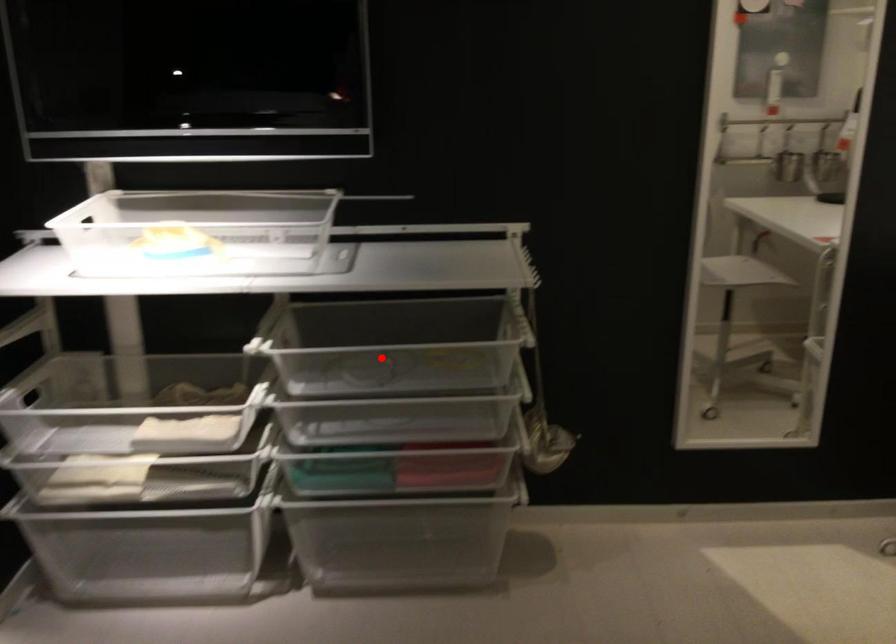
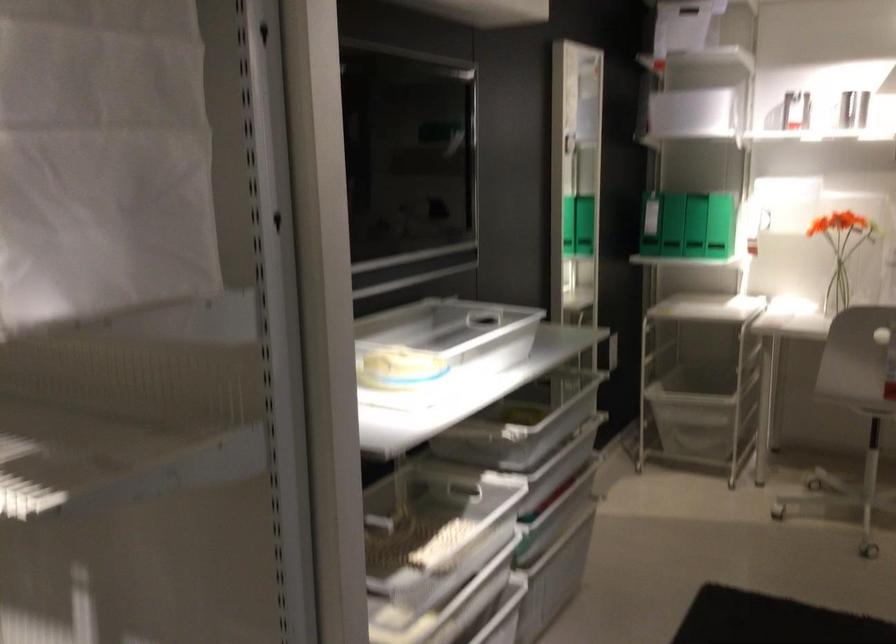
Question: I am providing you with two images of the same scene from different viewpoints. A red point is marked on the first image. Is the red point's position out of view in image 2?

Choices:
 (A) Yes
 (B) No

Answer: (A)